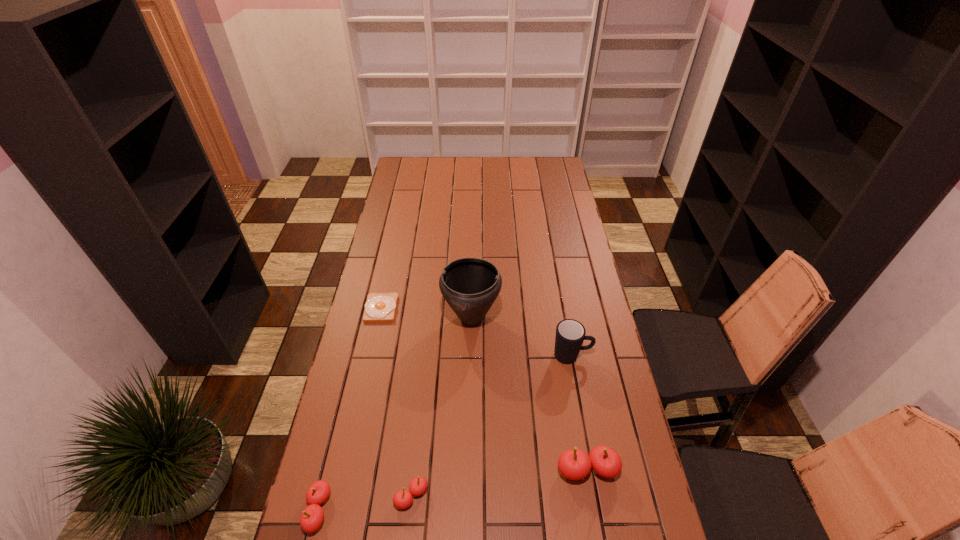
At what (x,y) coordinates should I click in order to perform the action: click on vacant space located 0.050m on the back of the fourth object from right to left. Please return your answer as a coordinate pair (x, y). Looking at the image, I should click on (415, 463).

In order to click on free spot located on the back of the rightmost cherry in this screenshot , I will do `click(565, 345)`.

Locate an element on the screen. The width and height of the screenshot is (960, 540). free space located on the back of the shortest object is located at coordinates (387, 281).

I want to click on vacant space located on the front of the fourth object from left to right, so click(x=469, y=390).

You are a GUI agent. You are given a task and a screenshot of the screen. Output one action in this format:
    pyautogui.click(x=<x>, y=<y>)
    Task: Click on the cherry that is at the left edge
    The width and height of the screenshot is (960, 540).
    Given the screenshot: What is the action you would take?
    pyautogui.click(x=312, y=516)

The image size is (960, 540). In order to click on toast positioned at the left edge in this screenshot , I will do `click(380, 307)`.

You are a GUI agent. You are given a task and a screenshot of the screen. Output one action in this format:
    pyautogui.click(x=<x>, y=<y>)
    Task: Click on the cherry present at the right edge
    The height and width of the screenshot is (540, 960).
    Given the screenshot: What is the action you would take?
    pyautogui.click(x=574, y=464)

This screenshot has width=960, height=540. I want to click on mug that is at the right edge, so click(570, 334).

Where is `object that is at the near left corner`? Image resolution: width=960 pixels, height=540 pixels. object that is at the near left corner is located at coordinates (312, 516).

Where is `vacant space at the far edge of the desktop`? vacant space at the far edge of the desktop is located at coordinates (474, 178).